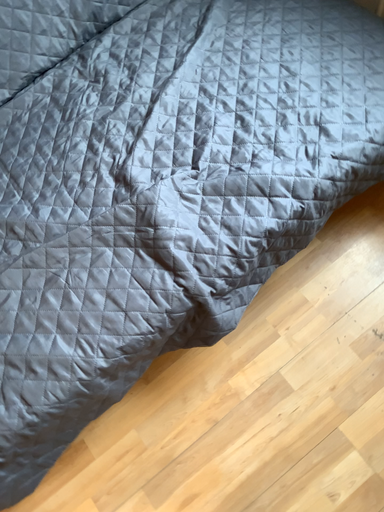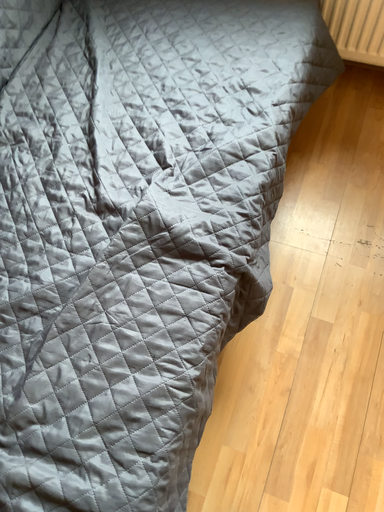
Question: How did the camera likely rotate when shooting the video?

Choices:
 (A) rotated right
 (B) rotated left

Answer: (A)